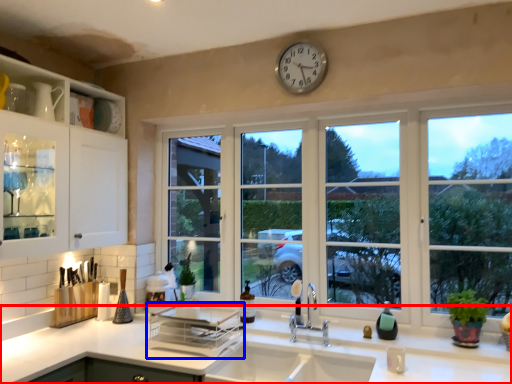
Question: Which of the following is the closest to the observer, countertop (highlighted by a red box) or appliance (highlighted by a blue box)?

Choices:
 (A) countertop
 (B) appliance

Answer: (A)